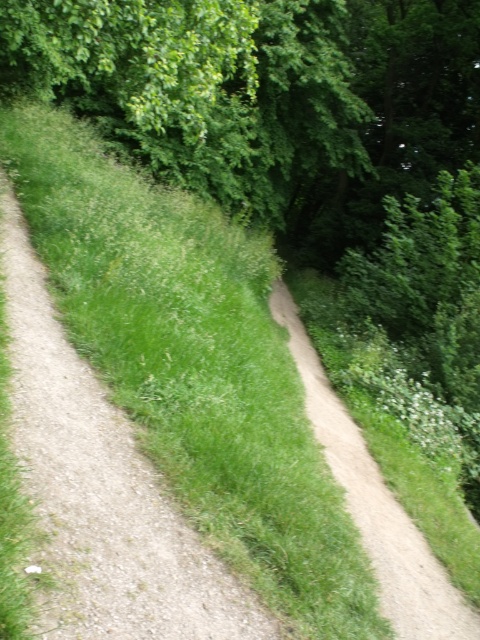
Who is lower down, green leafy tree at upper center or green grassy trail at center?

green grassy trail at center is below.

The width and height of the screenshot is (480, 640). Describe the element at coordinates (266, 97) in the screenshot. I see `green leafy tree at upper center` at that location.

Image resolution: width=480 pixels, height=640 pixels. I want to click on green leafy tree at upper center, so click(x=266, y=97).